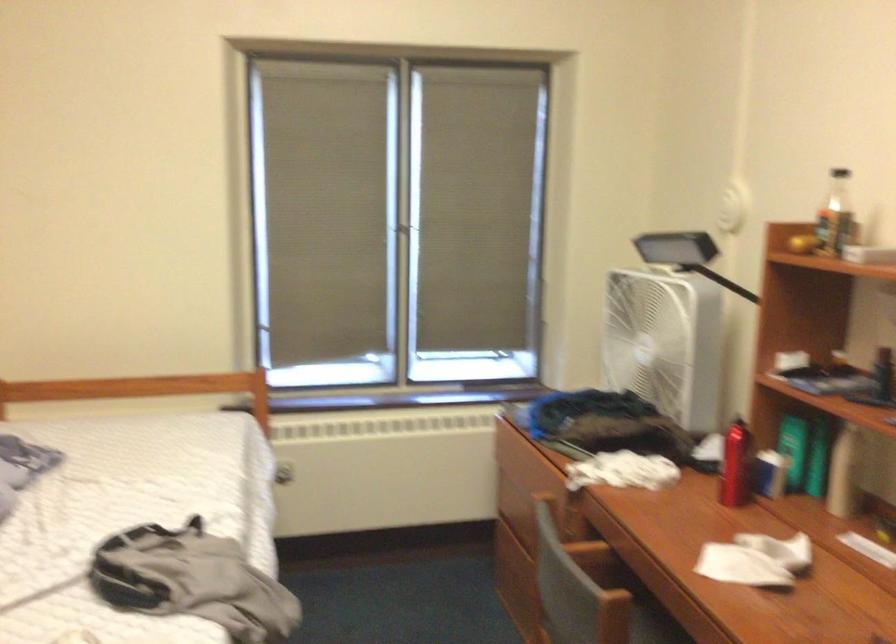
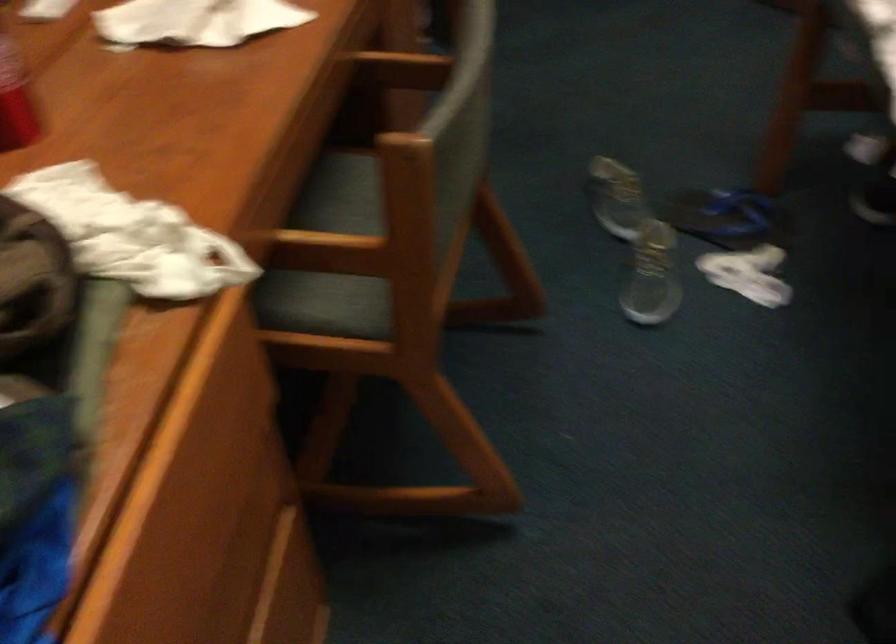
Where in the second image is the point corresponding to (579,554) from the first image?

(339, 250)